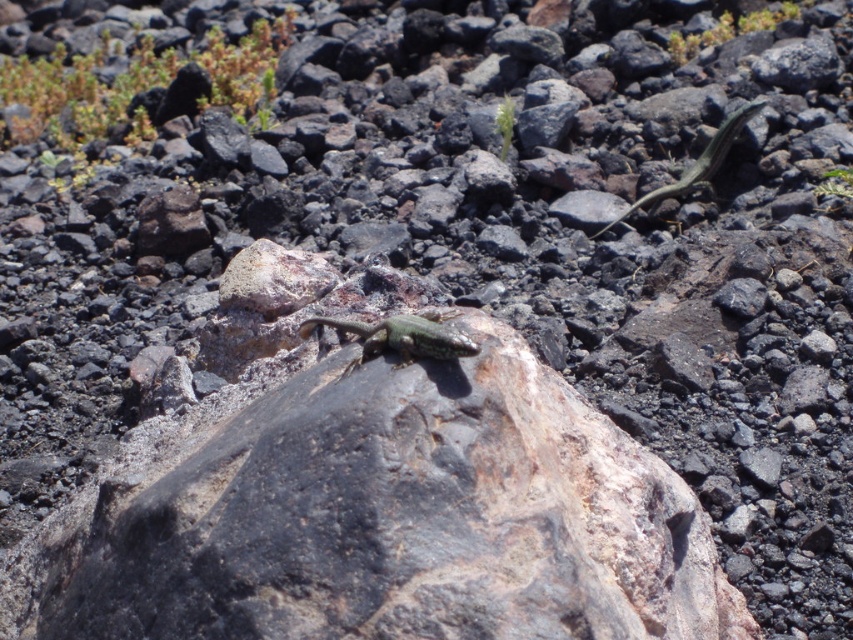
Question: Is green scaly lizard at center positioned in front of green glossy lizard at upper right?

Choices:
 (A) yes
 (B) no

Answer: (A)

Question: Among these objects, which one is farthest from the camera?

Choices:
 (A) green glossy lizard at upper right
 (B) green scaly lizard at center

Answer: (A)

Question: Can you confirm if green scaly lizard at center is positioned to the left of green glossy lizard at upper right?

Choices:
 (A) no
 (B) yes

Answer: (B)

Question: Is the position of green scaly lizard at center less distant than that of green glossy lizard at upper right?

Choices:
 (A) yes
 (B) no

Answer: (A)